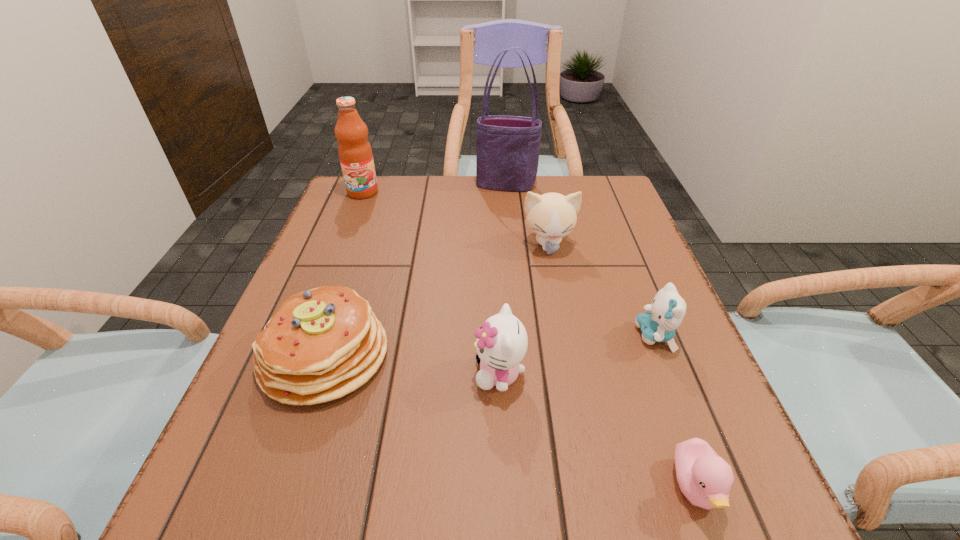
Locate an element on the screen. free space located 0.120m on the front label of the sixth shortest object is located at coordinates (350, 225).

Locate an element on the screen. The height and width of the screenshot is (540, 960). vacant space located 0.260m on the face of the farthest kitten is located at coordinates (568, 346).

You are a GUI agent. You are given a task and a screenshot of the screen. Output one action in this format:
    pyautogui.click(x=<x>, y=<y>)
    Task: Click on the free space located on the front-facing side of the leftmost kitten
    
    Given the screenshot: What is the action you would take?
    pyautogui.click(x=376, y=373)

Where is `vacant space located on the front-facing side of the leftmost kitten`? This screenshot has width=960, height=540. vacant space located on the front-facing side of the leftmost kitten is located at coordinates pyautogui.click(x=411, y=373).

Where is `vacant space located on the front-facing side of the leftmost kitten`? vacant space located on the front-facing side of the leftmost kitten is located at coordinates (290, 373).

Find the location of `free spot located on the face of the rightmost kitten`. free spot located on the face of the rightmost kitten is located at coordinates (457, 335).

Find the location of `vacant area situated on the face of the rightmost kitten`. vacant area situated on the face of the rightmost kitten is located at coordinates (462, 335).

Locate an element on the screen. The image size is (960, 540). vacant space located 0.170m on the face of the rightmost kitten is located at coordinates point(546,335).

At what (x,y) coordinates should I click in order to perform the action: click on free space located on the right of the pancake. Please return your answer as a coordinate pair (x, y). This screenshot has height=540, width=960. Looking at the image, I should click on (553, 355).

The height and width of the screenshot is (540, 960). What are the coordinates of `tote bag located at the far edge` in the screenshot? It's located at (508, 147).